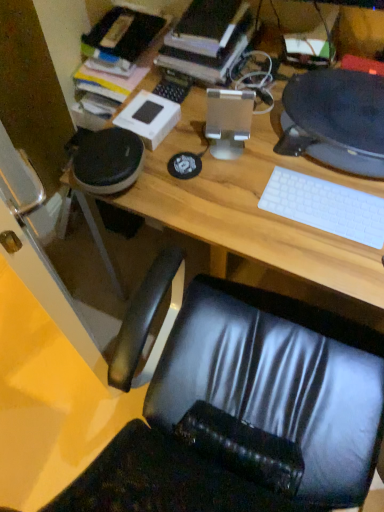
Question: Does satin silver desktop computer at center, which is the 2th desktop computer from right to left, have a greater width compared to matte black desktop computer at upper right, which ranks as the second desktop computer in left-to-right order?

Choices:
 (A) yes
 (B) no

Answer: (B)

Question: Does satin silver desktop computer at center, which is the 2th desktop computer from right to left, have a greater height compared to matte black desktop computer at upper right, which appears as the first desktop computer when viewed from the right?

Choices:
 (A) no
 (B) yes

Answer: (B)

Question: Is satin silver desktop computer at center, which ranks as the first desktop computer in left-to-right order, outside matte black desktop computer at upper right, which appears as the first desktop computer when viewed from the right?

Choices:
 (A) yes
 (B) no

Answer: (A)

Question: Is satin silver desktop computer at center, which is the 2th desktop computer from right to left, turned away from matte black desktop computer at upper right, which appears as the first desktop computer when viewed from the right?

Choices:
 (A) no
 (B) yes

Answer: (A)

Question: From a real-world perspective, is satin silver desktop computer at center, which is the 2th desktop computer from right to left, positioned under matte black desktop computer at upper right, which ranks as the second desktop computer in left-to-right order, based on gravity?

Choices:
 (A) yes
 (B) no

Answer: (B)

Question: Is hardcover book at upper center taller or shorter than matte black desktop computer at upper right, which appears as the first desktop computer when viewed from the right?

Choices:
 (A) short
 (B) tall

Answer: (B)

Question: In terms of size, does hardcover book at upper center appear bigger or smaller than matte black desktop computer at upper right, which ranks as the second desktop computer in left-to-right order?

Choices:
 (A) big
 (B) small

Answer: (A)

Question: Choose the correct answer: Is hardcover book at upper center inside matte black desktop computer at upper right, which ranks as the second desktop computer in left-to-right order, or outside it?

Choices:
 (A) inside
 (B) outside

Answer: (B)

Question: Considering the positions of point (228, 46) and point (311, 147), is point (228, 46) closer or farther from the camera than point (311, 147)?

Choices:
 (A) closer
 (B) farther

Answer: (B)

Question: From the image's perspective, is wooden desk at center positioned above or below white matte keyboard at right?

Choices:
 (A) above
 (B) below

Answer: (B)

Question: Is wooden desk at center taller or shorter than white matte keyboard at right?

Choices:
 (A) short
 (B) tall

Answer: (B)

Question: Does point (223, 237) appear closer or farther from the camera than point (329, 211)?

Choices:
 (A) closer
 (B) farther

Answer: (A)

Question: Looking at their shapes, would you say wooden desk at center is wider or thinner than white matte keyboard at right?

Choices:
 (A) thin
 (B) wide

Answer: (B)

Question: Is matte black desktop computer at upper right, which appears as the first desktop computer when viewed from the right, wider or thinner than wooden desk at center?

Choices:
 (A) thin
 (B) wide

Answer: (A)

Question: Based on their sizes in the image, would you say matte black desktop computer at upper right, which appears as the first desktop computer when viewed from the right, is bigger or smaller than wooden desk at center?

Choices:
 (A) big
 (B) small

Answer: (B)